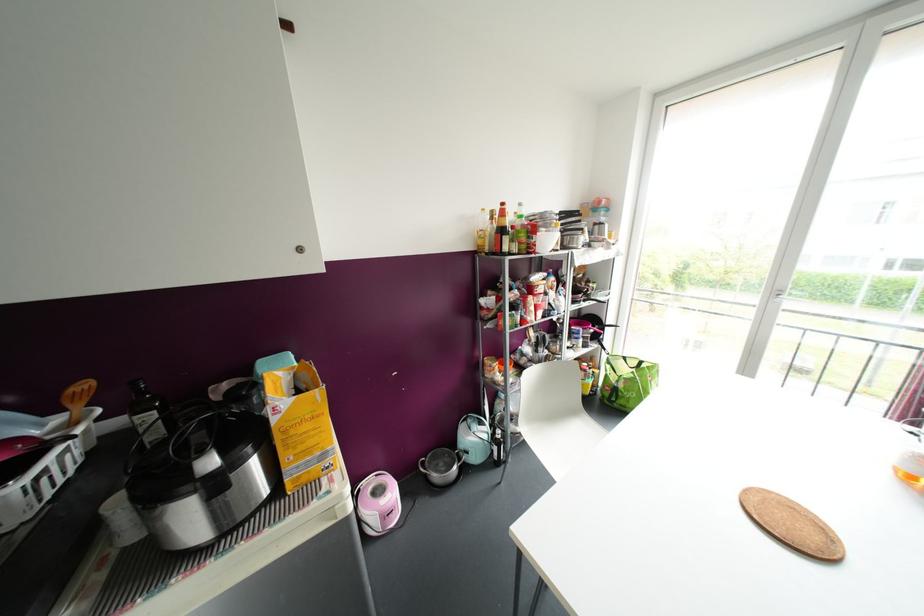
Find the location of a particular element. The height and width of the screenshot is (616, 924). rice cooker lid handle is located at coordinates (210, 469).